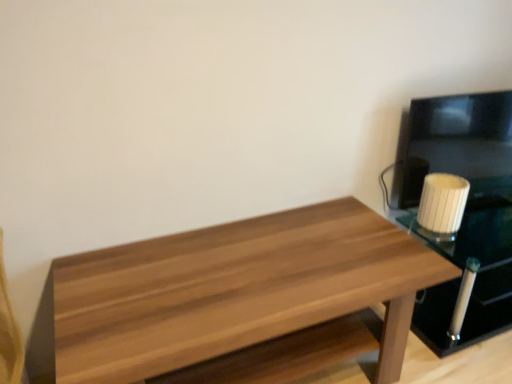
Locate an element on the screen. This screenshot has width=512, height=384. blank space situated above wooden table at center (from a real-world perspective) is located at coordinates (258, 266).